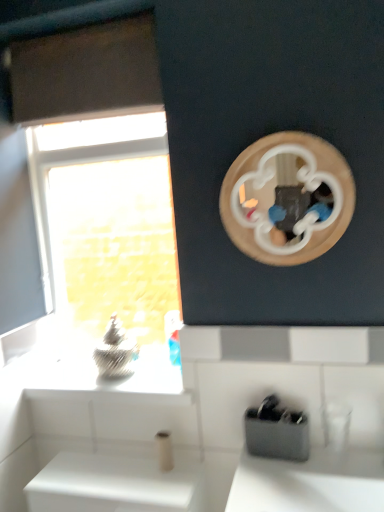
The image size is (384, 512). What do you see at coordinates (99, 199) in the screenshot? I see `transparent glass window at left` at bounding box center [99, 199].

Identify the location of transparent glass window at left. (99, 199).

The image size is (384, 512). Describe the element at coordinates (277, 431) in the screenshot. I see `black plastic toothbrush holder at lower center` at that location.

The height and width of the screenshot is (512, 384). I want to click on black plastic toothbrush holder at lower center, so click(x=277, y=431).

Where is `transparent glass window at left`? This screenshot has width=384, height=512. transparent glass window at left is located at coordinates (99, 199).

Can you confirm if black plastic toothbrush holder at lower center is positioned to the right of transparent glass window at left?

Indeed, black plastic toothbrush holder at lower center is positioned on the right side of transparent glass window at left.

Between black plastic toothbrush holder at lower center and transparent glass window at left, which one is positioned in front?

black plastic toothbrush holder at lower center is closer to the camera.

Between point (249, 428) and point (137, 381), which one is positioned behind?

The point (137, 381) is behind.

In the scene shown: From the image's perspective, is black plastic toothbrush holder at lower center located beneath transparent glass window at left?

Yes.

Looking at this image, from a real-world perspective, which object stands above the other?

In real-world perspective, transparent glass window at left is above.

Does black plastic toothbrush holder at lower center have a greater width compared to transparent glass window at left?

Yes.

In terms of height, does black plastic toothbrush holder at lower center look taller or shorter compared to transparent glass window at left?

Clearly, black plastic toothbrush holder at lower center is shorter compared to transparent glass window at left.

Looking at this image, can you confirm if black plastic toothbrush holder at lower center is bigger than transparent glass window at left?

No, black plastic toothbrush holder at lower center is not bigger than transparent glass window at left.

Would you say transparent glass window at left is part of black plastic toothbrush holder at lower center's contents?

Definitely not — transparent glass window at left is not inside black plastic toothbrush holder at lower center.

Is black plastic toothbrush holder at lower center next to transparent glass window at left and touching it?

black plastic toothbrush holder at lower center and transparent glass window at left are clearly separated.

Is transparent glass window at left at the back of black plastic toothbrush holder at lower center?

No, black plastic toothbrush holder at lower center is not facing the opposite direction of transparent glass window at left.

Can you tell me how much black plastic toothbrush holder at lower center and transparent glass window at left differ in facing direction?

3.19 degrees separate the facing orientations of black plastic toothbrush holder at lower center and transparent glass window at left.

How far apart are black plastic toothbrush holder at lower center and transparent glass window at left?

The distance of black plastic toothbrush holder at lower center from transparent glass window at left is 7.82 feet.

Identify the location of appliance to the right of transparent glass window at left. (277, 431).

Is transparent glass window at left at the left side of black plastic toothbrush holder at lower center?

Yes.

Is transparent glass window at left in front of or behind black plastic toothbrush holder at lower center in the image?

Clearly, transparent glass window at left is behind black plastic toothbrush holder at lower center.

Which is nearer, (50, 337) or (264, 442)?

Point (50, 337) is farther from the camera than point (264, 442).

From the image's perspective, is transparent glass window at left on top of black plastic toothbrush holder at lower center?

Yes.

From a real-world perspective, is transparent glass window at left beneath black plastic toothbrush holder at lower center?

No, from a real-world perspective, transparent glass window at left is not beneath black plastic toothbrush holder at lower center.

Consider the image. Considering the sizes of objects transparent glass window at left and black plastic toothbrush holder at lower center in the image provided, who is wider, transparent glass window at left or black plastic toothbrush holder at lower center?

With larger width is black plastic toothbrush holder at lower center.

From the picture: Considering the sizes of transparent glass window at left and black plastic toothbrush holder at lower center in the image, is transparent glass window at left taller or shorter than black plastic toothbrush holder at lower center?

Considering their sizes, transparent glass window at left has more height than black plastic toothbrush holder at lower center.

Does transparent glass window at left have a smaller size compared to black plastic toothbrush holder at lower center?

Incorrect, transparent glass window at left is not smaller in size than black plastic toothbrush holder at lower center.

Is black plastic toothbrush holder at lower center inside transparent glass window at left?

No, black plastic toothbrush holder at lower center is not surrounded by transparent glass window at left.

Is there a large distance between transparent glass window at left and black plastic toothbrush holder at lower center?

transparent glass window at left is far away from black plastic toothbrush holder at lower center.

Does transparent glass window at left turn towards black plastic toothbrush holder at lower center?

No.

Where is `appliance below the transparent glass window at left (from a real-world perspective)`? appliance below the transparent glass window at left (from a real-world perspective) is located at coordinates (277, 431).

Image resolution: width=384 pixels, height=512 pixels. In order to click on appliance beneath the transparent glass window at left (from a real-world perspective) in this screenshot , I will do `click(277, 431)`.

Identify the location of window above the black plastic toothbrush holder at lower center (from a real-world perspective). (99, 199).